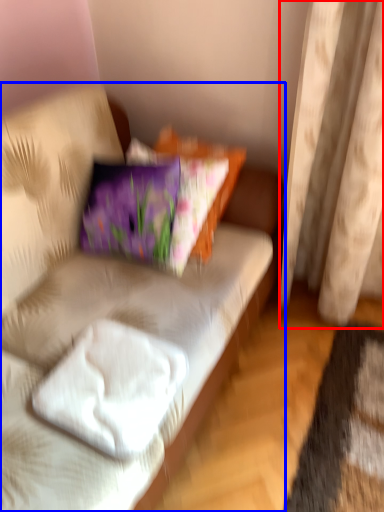
Question: Among these objects, which one is farthest to the camera, curtain (highlighted by a red box) or studio couch (highlighted by a blue box)?

Choices:
 (A) curtain
 (B) studio couch

Answer: (A)